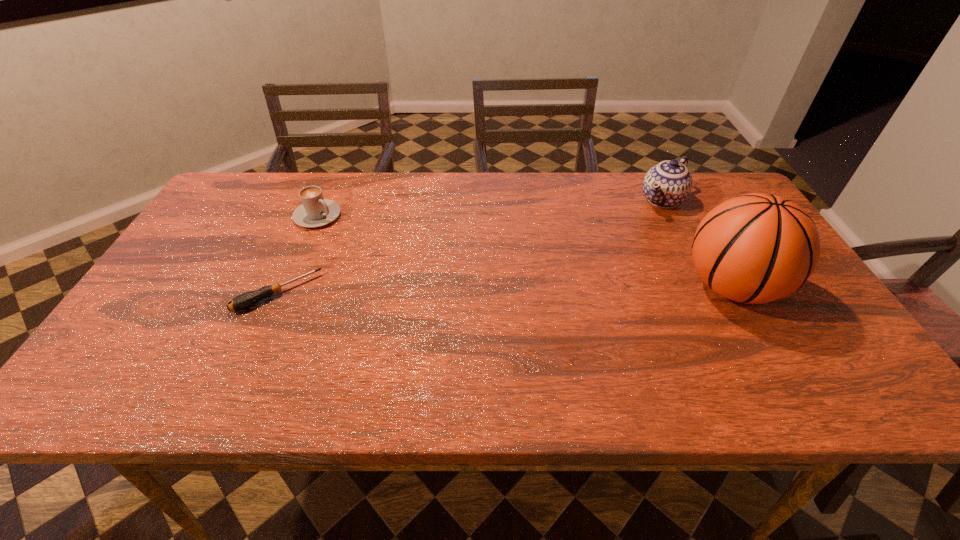
Locate an element on the screen. vacant area that lies between the basketball and the shortest object is located at coordinates (504, 290).

I want to click on vacant space that's between the shortest object and the tallest object, so click(x=504, y=290).

What are the coordinates of `the closest object relative to the basketball` in the screenshot? It's located at (668, 184).

Identify which object is the second nearest to the chinaware. Please provide its 2D coordinates. Your answer should be formatted as a tuple, i.e. [(x, y)], where the tuple contains the x and y coordinates of a point satisfying the conditions above.

[(315, 211)]